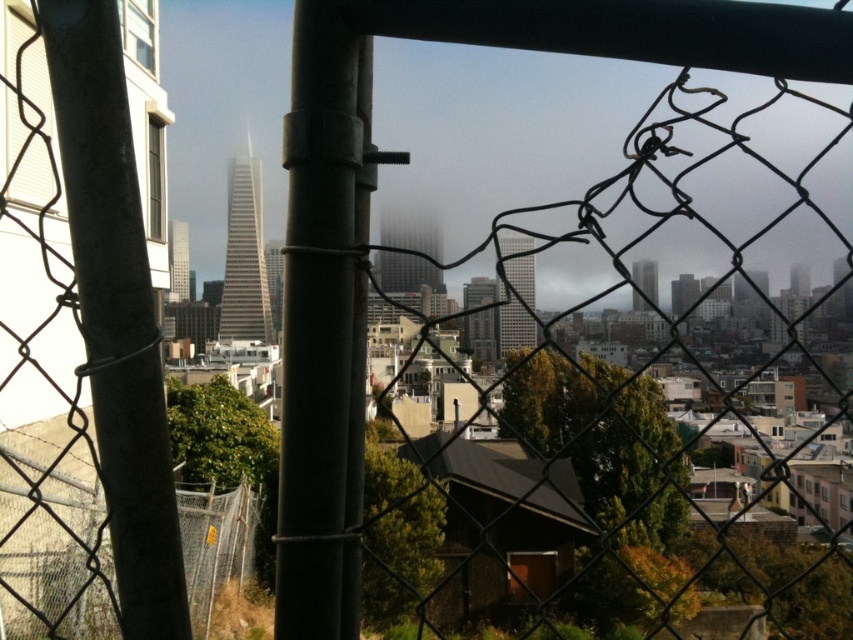
Question: Estimate the real-world distances between objects in this image. Which object is closer to the metallic chain-link fence at lower left?

Choices:
 (A) metallic pole at left
 (B) matte black pole at center

Answer: (A)

Question: Is the position of matte black pole at center less distant than that of metallic chain-link fence at lower left?

Choices:
 (A) yes
 (B) no

Answer: (A)

Question: Is metallic pole at left smaller than metallic chain-link fence at lower left?

Choices:
 (A) no
 (B) yes

Answer: (B)

Question: Can you confirm if metallic pole at left is smaller than metallic chain-link fence at lower left?

Choices:
 (A) yes
 (B) no

Answer: (A)

Question: Which object is the closest to the matte black pole at center?

Choices:
 (A) metallic chain-link fence at lower left
 (B) metallic pole at left

Answer: (B)

Question: Which object is the closest to the metallic pole at left?

Choices:
 (A) matte black pole at center
 (B) metallic chain-link fence at lower left

Answer: (B)